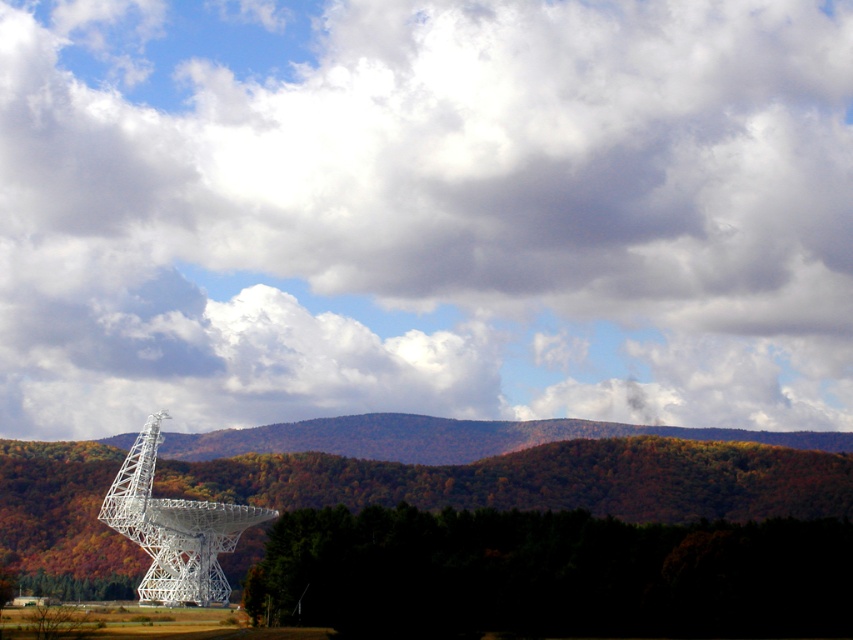
Question: Is cloudy sky at upper center wider than white metallic satellite at center?

Choices:
 (A) yes
 (B) no

Answer: (A)

Question: Is cloudy sky at upper center wider than white metallic satellite at center?

Choices:
 (A) yes
 (B) no

Answer: (A)

Question: Does cloudy sky at upper center come in front of white metallic satellite at center?

Choices:
 (A) no
 (B) yes

Answer: (A)

Question: Which of the following is the farthest from the observer?

Choices:
 (A) cloudy sky at upper center
 (B) white metallic satellite at center

Answer: (A)